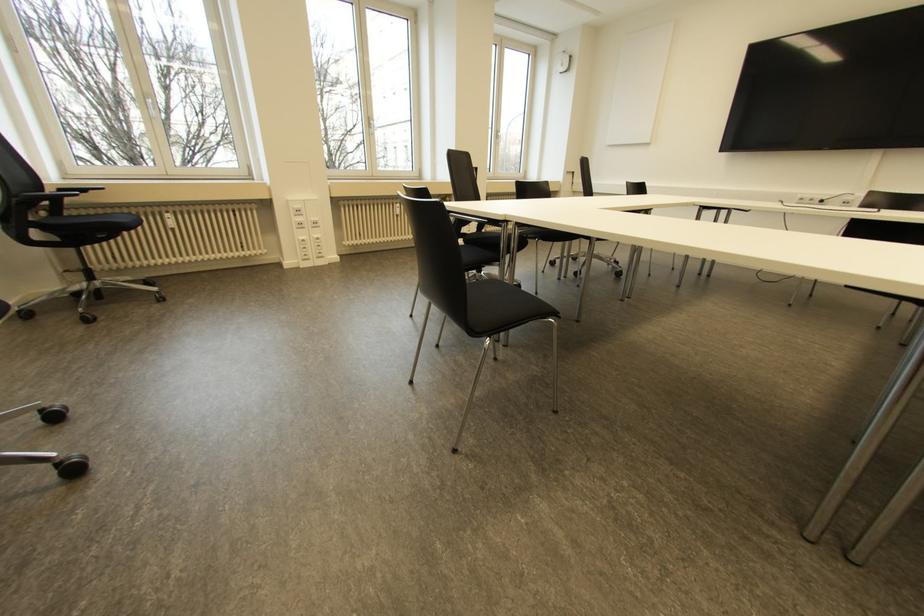
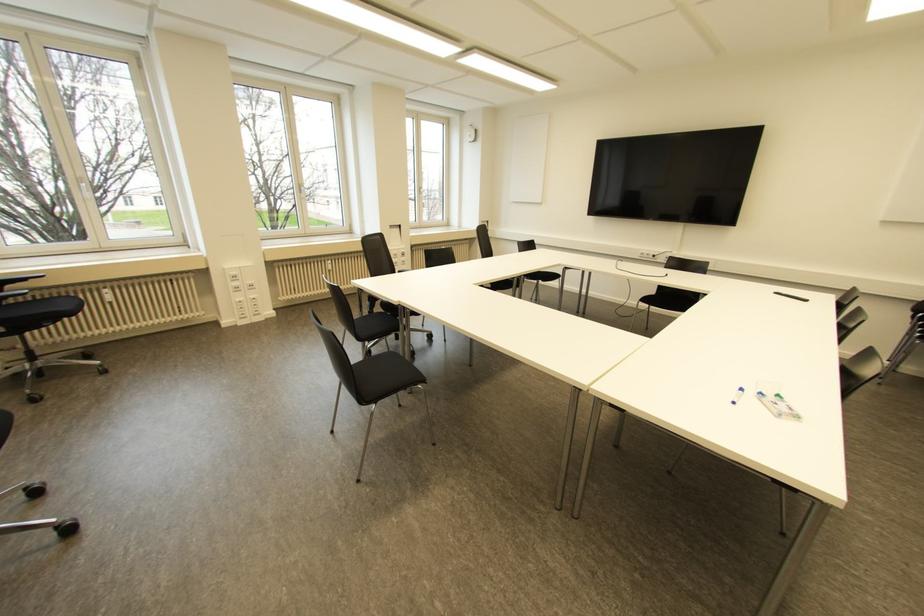
Question: How did the camera likely rotate?

Choices:
 (A) Left
 (B) Right
 (C) Up
 (D) Down

Answer: (B)